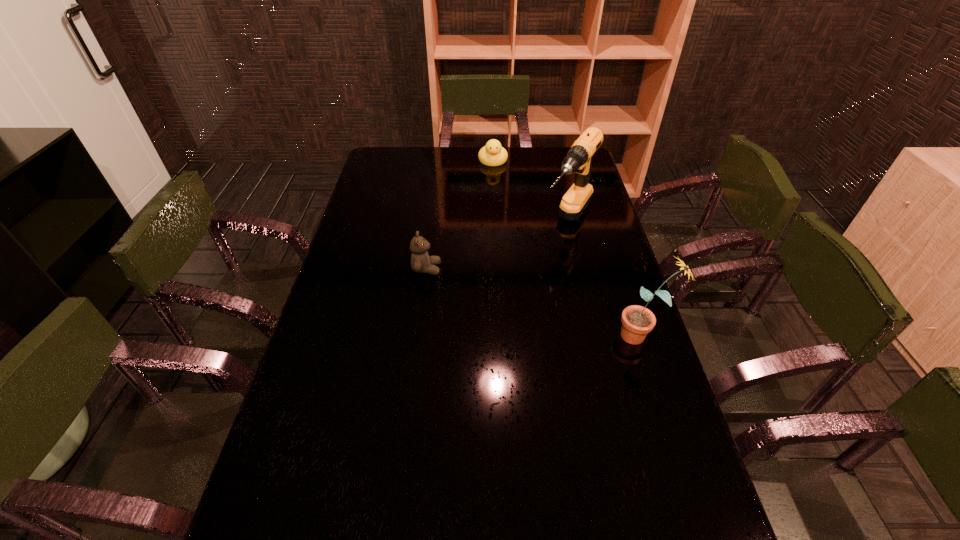
At what (x,y) coordinates should I click in order to perform the action: click on vacant space at the near edge of the desktop. Please return your answer as a coordinate pair (x, y). The height and width of the screenshot is (540, 960). Looking at the image, I should click on (355, 516).

Where is `free space at the left edge of the desktop`? The height and width of the screenshot is (540, 960). free space at the left edge of the desktop is located at coordinates (345, 399).

In the image, there is a desktop. Where is `free space at the right edge`? Image resolution: width=960 pixels, height=540 pixels. free space at the right edge is located at coordinates (603, 314).

In the image, there is a desktop. At what (x,y) coordinates should I click in order to perform the action: click on vacant space at the far left corner. Please return your answer as a coordinate pair (x, y). The width and height of the screenshot is (960, 540). Looking at the image, I should click on (399, 166).

The width and height of the screenshot is (960, 540). Identify the location of free location at the far right corner of the desktop. click(559, 170).

You are a GUI agent. You are given a task and a screenshot of the screen. Output one action in this format:
    pyautogui.click(x=<x>, y=<y>)
    Task: Click on the free space between the duckling and the teddy bear
    The width and height of the screenshot is (960, 540).
    Given the screenshot: What is the action you would take?
    click(460, 214)

This screenshot has height=540, width=960. I want to click on vacant area that lies between the drill and the nearest object, so click(x=605, y=279).

I want to click on unoccupied position between the leftmost object and the sunflower, so click(534, 302).

Where is `empty location between the drill and the shortest object`? empty location between the drill and the shortest object is located at coordinates (531, 192).

The height and width of the screenshot is (540, 960). In order to click on unoccupied position between the sunflower and the second shortest object in this screenshot , I will do `click(534, 302)`.